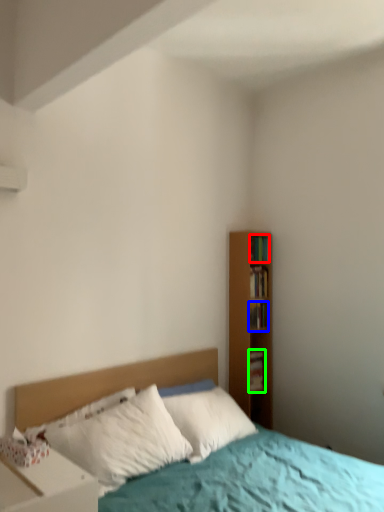
Question: Based on their relative distances, which object is nearer to book (highlighted by a red box)? Choose from book (highlighted by a blue box) and book (highlighted by a green box).

Choices:
 (A) book
 (B) book

Answer: (A)